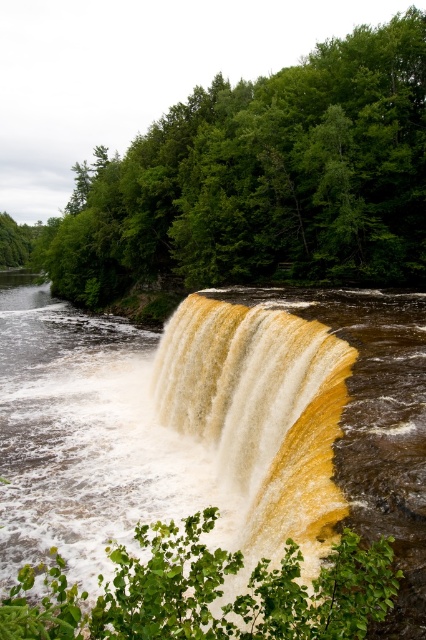
Can you confirm if brown textured waterfall at center is taller than green leafy trees at center?

No, brown textured waterfall at center is not taller than green leafy trees at center.

From the picture: Is brown textured waterfall at center wider than green leafy trees at center?

No.

Which is in front, point (368, 480) or point (175, 196)?

Point (368, 480)

Where is `brown textured waterfall at center`? This screenshot has width=426, height=640. brown textured waterfall at center is located at coordinates (86, 436).

Can you confirm if brown textured waterfall at center is positioned to the right of yellowish water at center?

No, brown textured waterfall at center is not to the right of yellowish water at center.

Locate an element on the screen. brown textured waterfall at center is located at coordinates (86, 436).

Does green leafy trees at center have a lesser height compared to yellowish water at center?

Incorrect, green leafy trees at center's height does not fall short of yellowish water at center's.

Is green leafy trees at center above yellowish water at center?

Correct, green leafy trees at center is located above yellowish water at center.

Between point (394, 28) and point (305, 481), which one is positioned in front?

Point (305, 481) is more forward.

Find the location of a particular element. green leafy trees at center is located at coordinates (264, 179).